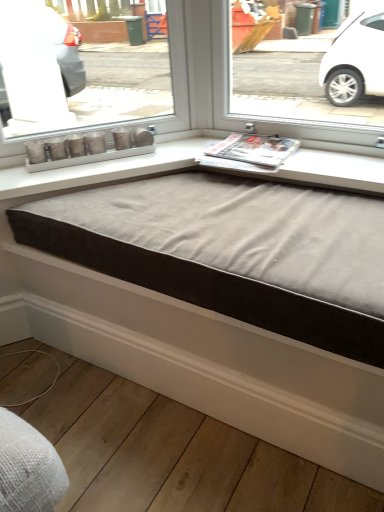
The image size is (384, 512). I want to click on vacant area that is in front of matte silver candlesticks at center, so click(x=101, y=198).